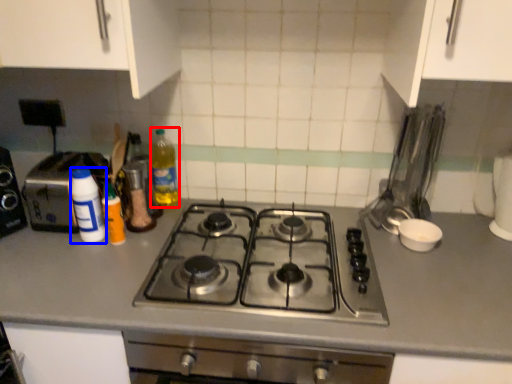
Question: Which point is further to the camera, bottle (highlighted by a red box) or bottle (highlighted by a blue box)?

Choices:
 (A) bottle
 (B) bottle

Answer: (A)